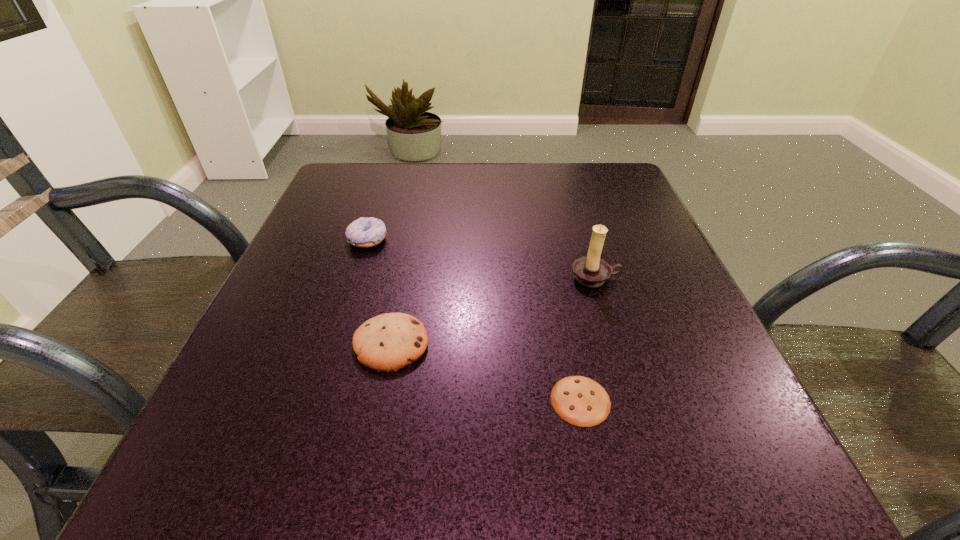
This screenshot has width=960, height=540. I want to click on free spot between the right cookie and the third nearest object, so click(588, 339).

What are the coordinates of `vacant area that lies between the second farthest object and the nearer cookie` in the screenshot? It's located at (588, 339).

I want to click on empty location between the nearer cookie and the second farthest object, so pyautogui.click(x=588, y=339).

Find the location of a particular element. The image size is (960, 540). free space between the second nearest object and the doughnut is located at coordinates (379, 292).

Locate an element on the screen. vacant area that lies between the left cookie and the doughnut is located at coordinates (379, 292).

I want to click on free space that is in between the shortest object and the taller cookie, so click(x=486, y=372).

Find the location of a particular element. This screenshot has width=960, height=540. free area in between the taller cookie and the doughnut is located at coordinates (379, 292).

This screenshot has height=540, width=960. Identify the location of empty location between the right cookie and the farther cookie. (486, 372).

Locate an element on the screen. This screenshot has height=540, width=960. vacant area between the third nearest object and the farthest object is located at coordinates (482, 259).

I want to click on object that stands as the second closest to the candle holder, so click(388, 342).